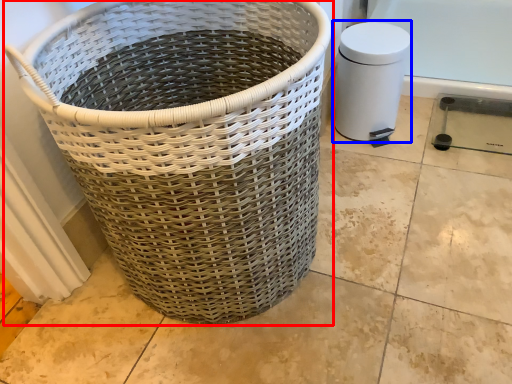
Question: Which object appears closest to the camera in this image, waste container (highlighted by a red box) or water heater (highlighted by a blue box)?

Choices:
 (A) waste container
 (B) water heater

Answer: (A)